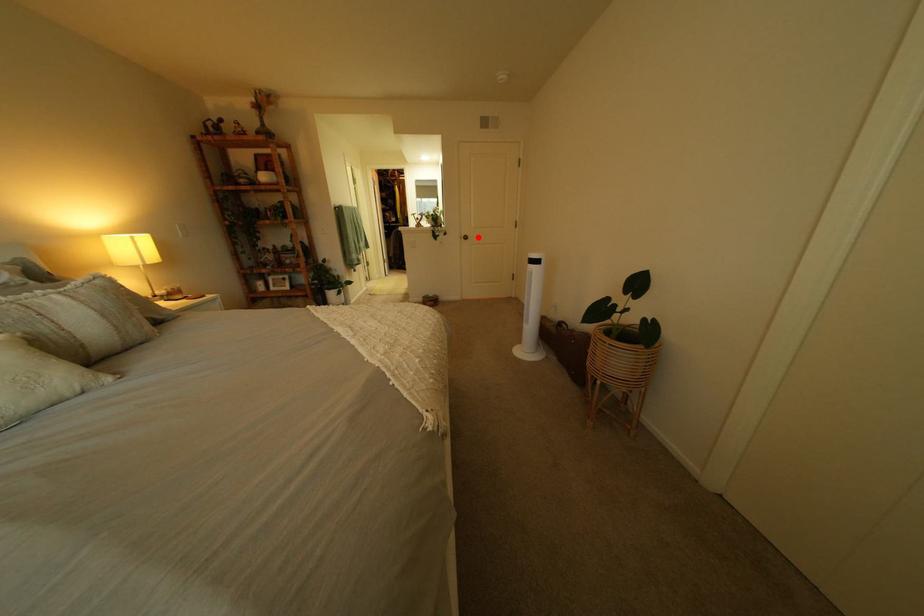
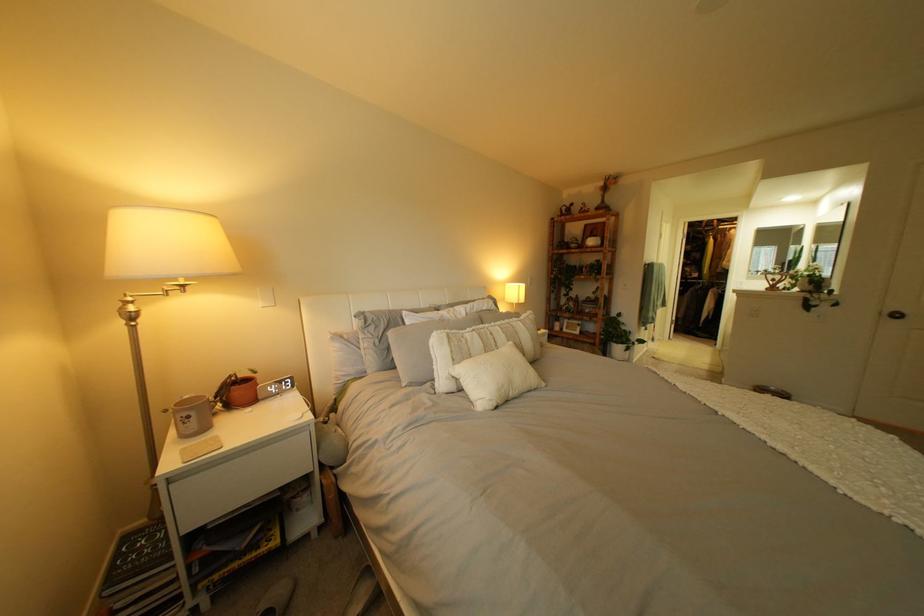
Question: A red point is marked in image1. In image2, is the corresponding 3D point closer to the camera or farther? Reply with the corresponding letter.

Choices:
 (A) The corresponding 3D point is closer.
 (B) The corresponding 3D point is farther.

Answer: (B)